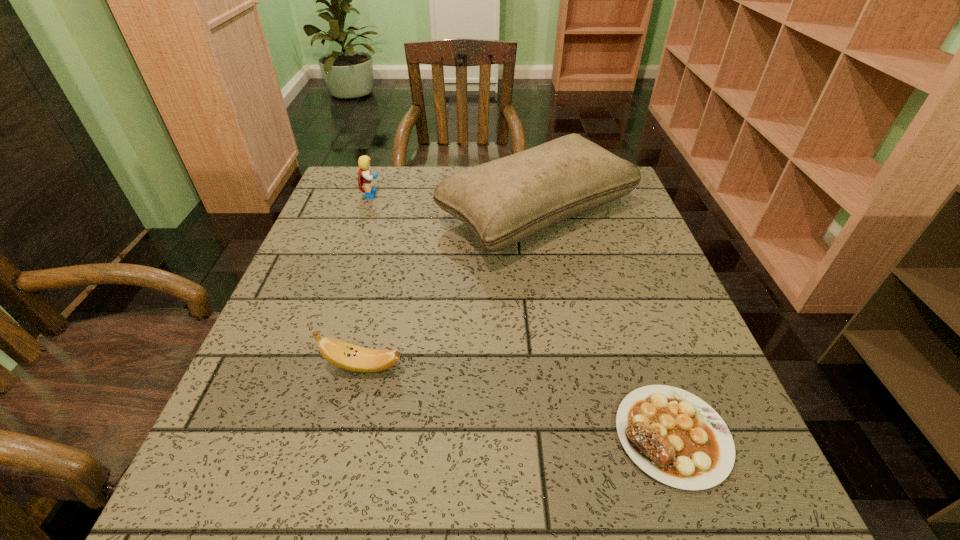
The height and width of the screenshot is (540, 960). In the image, there is a desktop. Identify the location of vacant space at the far edge. (465, 167).

I want to click on free region at the left edge of the desktop, so [270, 381].

Where is `free spot at the right edge of the desktop`? free spot at the right edge of the desktop is located at coordinates (644, 330).

The image size is (960, 540). I want to click on vacant space at the far left corner, so click(x=327, y=210).

In the image, there is a desktop. Identify the location of vacant space at the near left corner. The image size is (960, 540). (290, 509).

Locate an element on the screen. This screenshot has width=960, height=540. blank space at the near right corner of the desktop is located at coordinates 781,520.

Locate an element on the screen. Image resolution: width=960 pixels, height=540 pixels. free point between the third farthest object and the cushion is located at coordinates (450, 289).

The image size is (960, 540). Identify the location of empty space between the banana and the Lego. (368, 281).

Identify the location of free space between the third tallest object and the third shortest object. The image size is (960, 540). (368, 281).

Locate an element on the screen. free spot between the third shortest object and the steak is located at coordinates (522, 315).